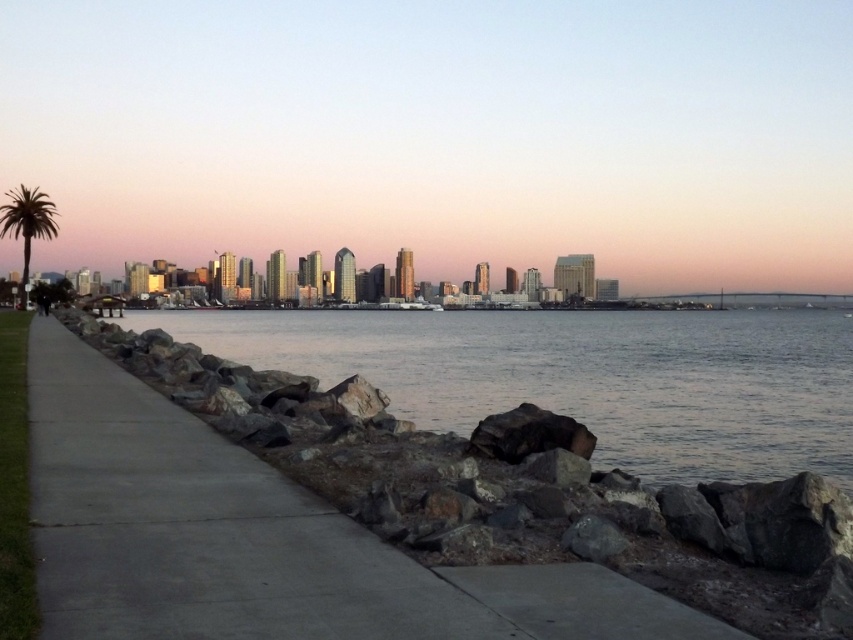
Question: Which of the following is the closest to the observer?

Choices:
 (A) black rock at center
 (B) green leafy palm tree at left
 (C) clear water at lower left
 (D) gray concrete sidewalk at lower left

Answer: (D)

Question: Among these points, which one is nearest to the camera?

Choices:
 (A) (339, 627)
 (B) (277, 324)
 (C) (572, 432)

Answer: (A)

Question: Can you confirm if black rock at center is bigger than green leafy palm tree at left?

Choices:
 (A) no
 (B) yes

Answer: (A)

Question: Which object is farther from the camera taking this photo?

Choices:
 (A) black rock at center
 (B) green leafy palm tree at left

Answer: (B)

Question: Considering the relative positions of clear water at lower left and black rock at center in the image provided, where is clear water at lower left located with respect to black rock at center?

Choices:
 (A) below
 (B) above

Answer: (B)

Question: Is clear water at lower left bigger than green leafy palm tree at left?

Choices:
 (A) yes
 (B) no

Answer: (B)